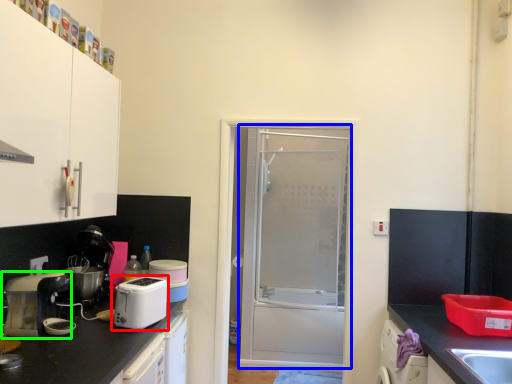
Question: Considering the real-world distances, which object is farthest from kitchen appliance (highlighted by a red box)? screen door (highlighted by a blue box) or home appliance (highlighted by a green box)?

Choices:
 (A) screen door
 (B) home appliance

Answer: (A)